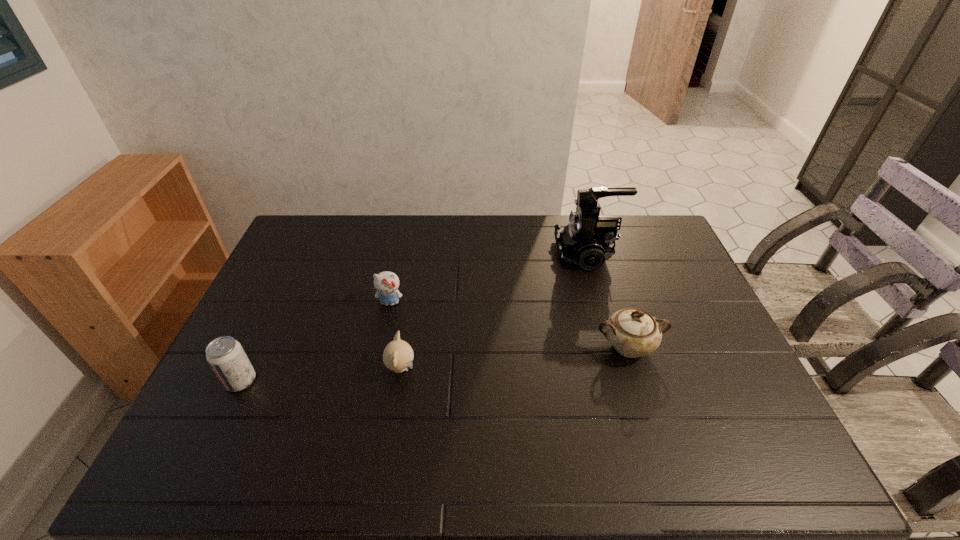
Locate an element on the screen. The image size is (960, 540). vacant space at the far right corner of the desktop is located at coordinates (649, 219).

Find the location of a particular element. The width and height of the screenshot is (960, 540). unoccupied area between the camcorder and the nearer kitten is located at coordinates (494, 311).

Image resolution: width=960 pixels, height=540 pixels. Find the location of `free spot between the soda can and the farthest object`. free spot between the soda can and the farthest object is located at coordinates (414, 317).

The width and height of the screenshot is (960, 540). I want to click on empty location between the chinaware and the second farthest object, so click(x=509, y=325).

This screenshot has height=540, width=960. In order to click on empty space that is in between the shortest object and the tallest object in this screenshot , I will do `click(494, 311)`.

Locate an element on the screen. vacant area that lies between the leftmost object and the farther kitten is located at coordinates (315, 341).

Identify the location of the closest object to the farthest object. (633, 332).

Identify which object is the second closest to the shorter kitten. Please provide its 2D coordinates. Your answer should be formatted as a tuple, i.e. [(x, y)], where the tuple contains the x and y coordinates of a point satisfying the conditions above.

[(225, 355)]

Where is `free location that satisfies the following two spatial constraints: 1. on the lens mount of the tallest object; 2. on the right side of the chinaware`? This screenshot has width=960, height=540. free location that satisfies the following two spatial constraints: 1. on the lens mount of the tallest object; 2. on the right side of the chinaware is located at coordinates (613, 347).

Locate an element on the screen. free location that satisfies the following two spatial constraints: 1. on the front-facing side of the second farthest object; 2. on the left side of the chinaware is located at coordinates (380, 347).